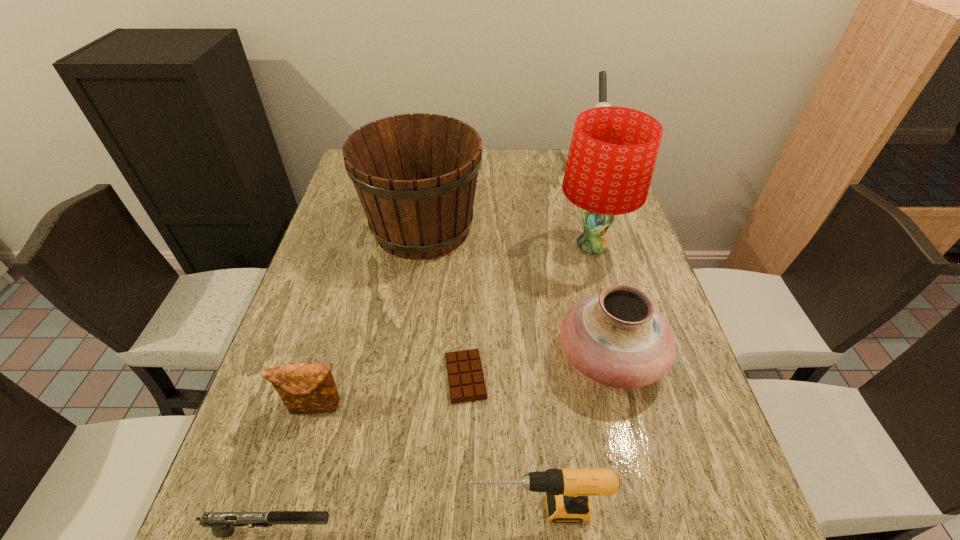
Locate an element on the screen. vacant space situated on the front-facing side of the tallest object is located at coordinates (468, 246).

Image resolution: width=960 pixels, height=540 pixels. Find the location of `free space located 0.150m on the front-facing side of the tallest object`. free space located 0.150m on the front-facing side of the tallest object is located at coordinates (500, 246).

This screenshot has height=540, width=960. Find the location of `vacant area located 0.290m at the eyepiece of the farthest object`. vacant area located 0.290m at the eyepiece of the farthest object is located at coordinates (612, 233).

This screenshot has width=960, height=540. Find the location of `free space located 0.240m on the right of the wine bucket`. free space located 0.240m on the right of the wine bucket is located at coordinates (564, 228).

Locate an element on the screen. This screenshot has width=960, height=540. vacant point located 0.210m on the front of the pottery is located at coordinates (650, 518).

Identify the location of vacant position located on the open side of the clutch bag. (295, 484).

The height and width of the screenshot is (540, 960). Identify the location of vacant space located 0.350m on the handle side of the drill. (264, 508).

This screenshot has width=960, height=540. Identify the location of vacant position located on the handle side of the drill. (347, 508).

Identify the location of free location located on the handle side of the drill. (375, 508).

You are a GUI agent. You are given a task and a screenshot of the screen. Output one action in this format:
    pyautogui.click(x=<x>, y=<y>)
    Task: Click on the vacant space located 0.160m at the muzzle end of the nearest object
    This screenshot has width=960, height=540.
    Given the screenshot: What is the action you would take?
    pyautogui.click(x=434, y=531)